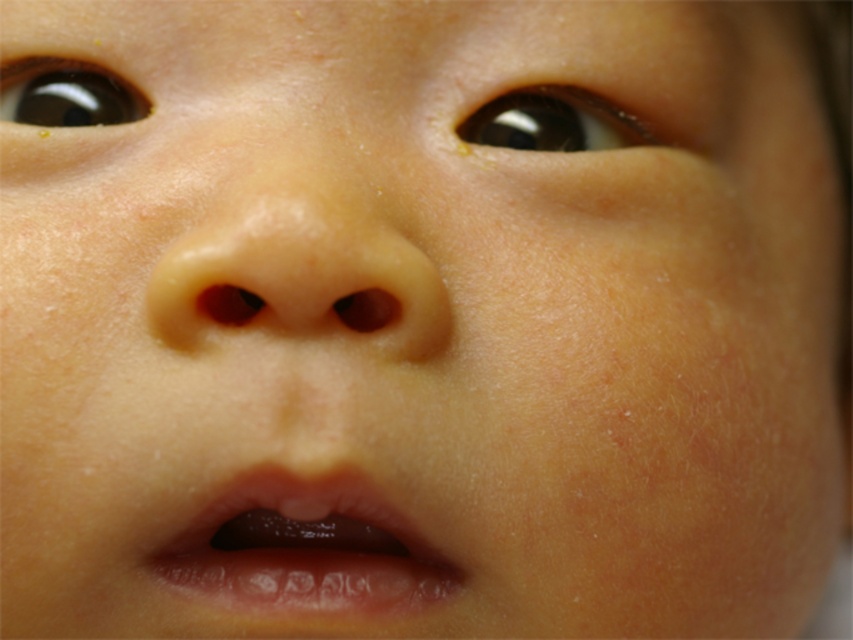
Is point (436, 340) behind point (479, 131)?

No, it is not.

Which is more to the right, smooth flesh-colored nose at center or brown glossy eye at upper center?

Positioned to the right is brown glossy eye at upper center.

Which is in front, point (357, 285) or point (549, 109)?

Point (357, 285)

Locate an element on the screen. The width and height of the screenshot is (853, 640). smooth flesh-colored nose at center is located at coordinates (299, 269).

Which of these two, smooth flesh-colored nose at center or translucent plastic teeth at lower center, stands shorter?

translucent plastic teeth at lower center is shorter.

Does smooth flesh-colored nose at center appear over translucent plastic teeth at lower center?

Yes.

Which is behind, point (399, 353) or point (387, 556)?

Point (387, 556)

This screenshot has height=640, width=853. I want to click on smooth flesh-colored nose at center, so click(x=299, y=269).

Does point (256, 483) lie in front of point (119, 108)?

Yes, it is in front of point (119, 108).

In the scene shown: Who is higher up, translucent plastic teeth at lower center or brown shiny eye at upper left?

Positioned higher is brown shiny eye at upper left.

The height and width of the screenshot is (640, 853). Find the location of `translucent plastic teeth at lower center`. translucent plastic teeth at lower center is located at coordinates (306, 548).